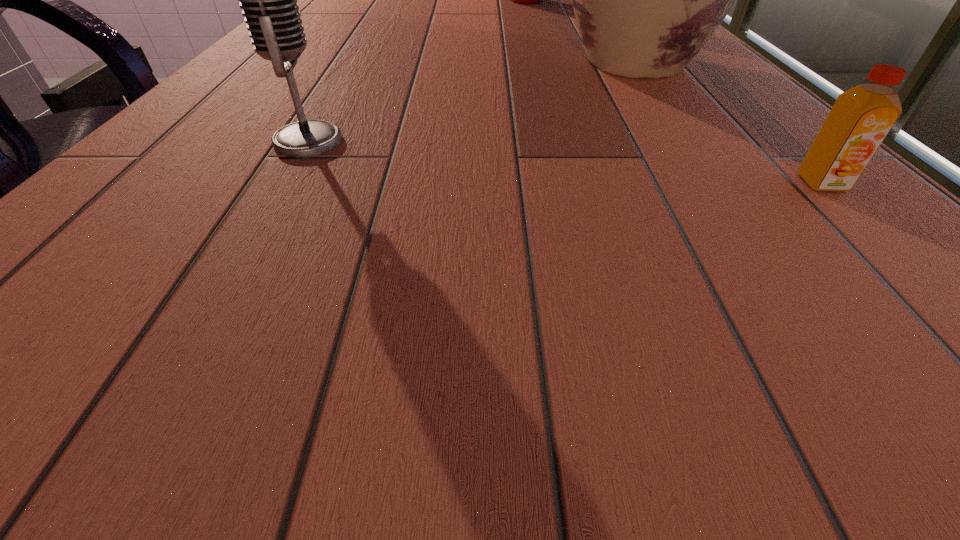
Find the location of a particular element. Image resolution: width=960 pixels, height=540 pixels. object present at the left edge is located at coordinates (269, 0).

Identify the location of orange juice that is at the right edge. (861, 118).

Locate an element on the screen. pitcher present at the right edge is located at coordinates (646, 0).

You are a GUI agent. You are given a task and a screenshot of the screen. Output one action in this format:
    pyautogui.click(x=<x>, y=<y>)
    Task: Click on the free space at the near edge of the desktop
    Image resolution: width=960 pixels, height=540 pixels.
    Given the screenshot: What is the action you would take?
    pyautogui.click(x=641, y=245)

Locate an element on the screen. The height and width of the screenshot is (540, 960). free space at the right edge of the desktop is located at coordinates (762, 112).

You are a GUI agent. You are given a task and a screenshot of the screen. Output one action in this format:
    pyautogui.click(x=<x>, y=<y>)
    Task: Click on the free point between the shortest object and the leftmost object
    The width and height of the screenshot is (960, 540).
    Given the screenshot: What is the action you would take?
    pyautogui.click(x=564, y=162)

Locate an element on the screen. This screenshot has width=960, height=540. free space between the shortest object and the pitcher is located at coordinates (727, 122).

I want to click on empty location between the third tallest object and the orange juice, so click(564, 162).

Identify the location of free space between the nearest object and the third farthest object. Image resolution: width=960 pixels, height=540 pixels. [564, 162].

Locate an element on the screen. Image resolution: width=960 pixels, height=540 pixels. object that is the second closest to the shortest object is located at coordinates (269, 0).